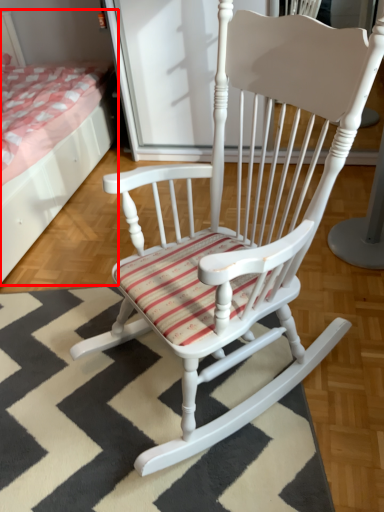
Question: From the image's perspective, where is bed (annotated by the red box) located relative to doormat?

Choices:
 (A) below
 (B) above

Answer: (B)